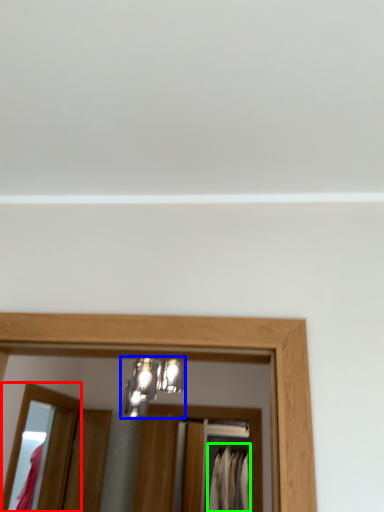
Question: Based on their relative distances, which object is farther from mirror (highlighted by a red box)? Choose from light fixture (highlighted by a blue box) and clothing (highlighted by a green box).

Choices:
 (A) light fixture
 (B) clothing

Answer: (B)